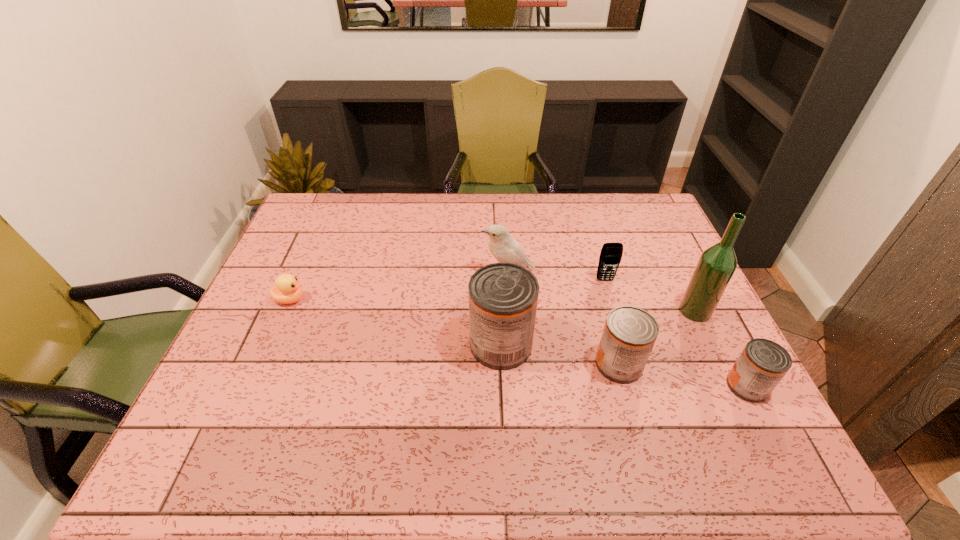
Where is `vacant region located on the left of the rightmost can`? The width and height of the screenshot is (960, 540). vacant region located on the left of the rightmost can is located at coordinates (635, 386).

Where is `vacant region located on the screen of the cellular telephone`? The image size is (960, 540). vacant region located on the screen of the cellular telephone is located at coordinates (622, 335).

Identify the location of vacant space located 0.120m at the beak of the bird. The width and height of the screenshot is (960, 540). (441, 274).

The image size is (960, 540). I want to click on vacant space situated at the beak of the bird, so (457, 274).

Where is `free space located at the beak of the bird`? Image resolution: width=960 pixels, height=540 pixels. free space located at the beak of the bird is located at coordinates (372, 274).

Locate an element on the screen. The width and height of the screenshot is (960, 540). free location located 0.210m on the back of the alcohol is located at coordinates (667, 253).

Where is `vacant space located 0.160m on the face of the shortest object`? The image size is (960, 540). vacant space located 0.160m on the face of the shortest object is located at coordinates (362, 300).

The height and width of the screenshot is (540, 960). Identify the location of object situated at the near edge. (762, 364).

Locate an element on the screen. This screenshot has width=960, height=540. object that is at the left edge is located at coordinates (287, 290).

You are a GUI agent. You are given a task and a screenshot of the screen. Output one action in this format:
    pyautogui.click(x=<x>, y=<y>)
    Task: Click on the can that is at the right edge
    
    Given the screenshot: What is the action you would take?
    pyautogui.click(x=762, y=364)